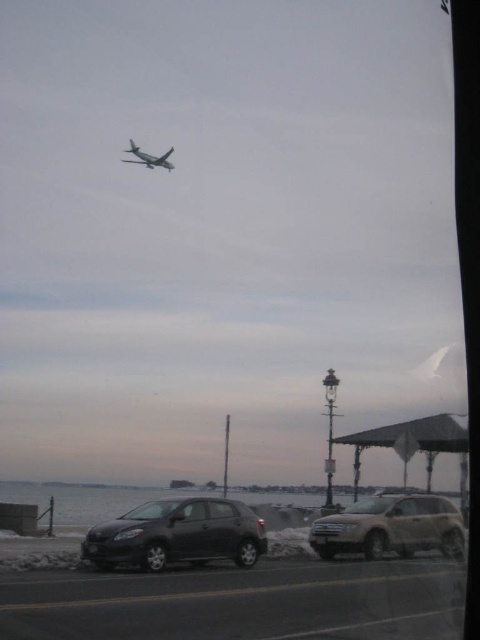
You are standing in front of a window and see a point marked at coordinates (x=178, y=534). Which object from the scene does this point belong to?

The point at coordinates (x=178, y=534) belongs to the matte black car at lower center.

You are a delivery drone operator. You need to fly your drone from the matte black car at lower center to the silver metallic airplane at upper center. Considering the sizes of both objects, which one might block the drone if it flies directly towards the airplane?

The matte black car at lower center is larger in size than the silver metallic airplane at upper center, so the matte black car at lower center might block the drone if it flies directly towards the airplane.